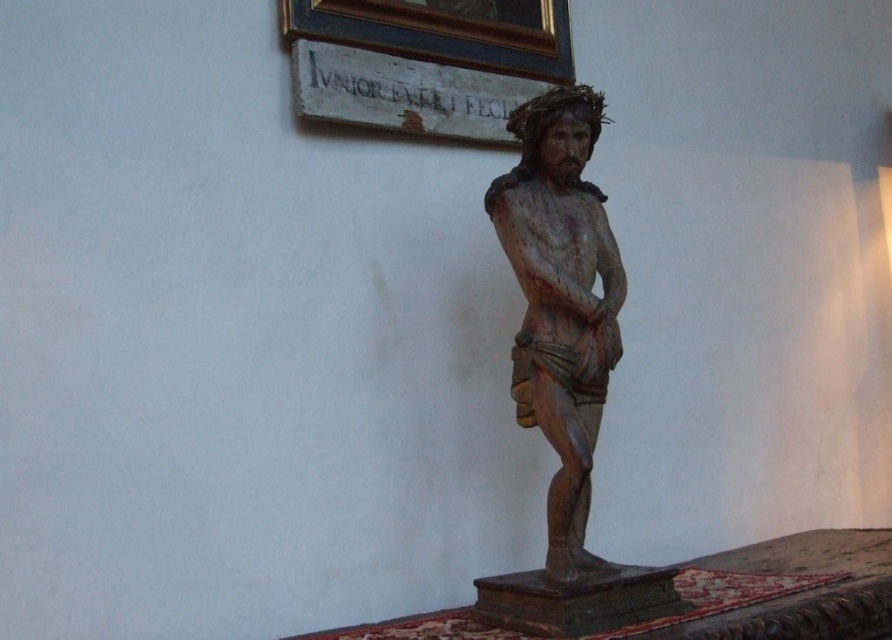
Question: From the image, what is the correct spatial relationship of wooden statue at center in relation to wooden plaque at upper center?

Choices:
 (A) right
 (B) left

Answer: (A)

Question: Does wooden statue at center have a smaller size compared to wooden plaque at upper center?

Choices:
 (A) no
 (B) yes

Answer: (A)

Question: From the image, what is the correct spatial relationship of wooden statue at center in relation to wooden plaque at upper center?

Choices:
 (A) left
 (B) right

Answer: (B)

Question: Which of the following is the farthest from the observer?

Choices:
 (A) (380, 84)
 (B) (551, 131)

Answer: (A)

Question: Which point appears farthest from the camera in this image?

Choices:
 (A) (486, 580)
 (B) (491, 61)

Answer: (B)